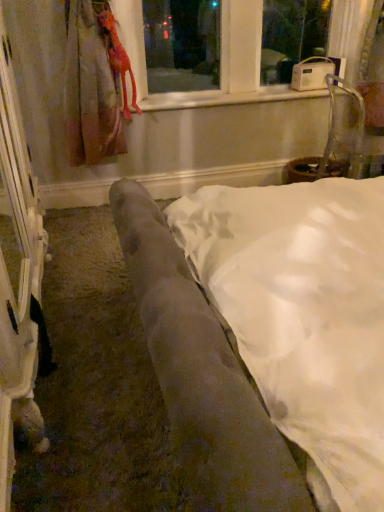
Question: Is white plastic radio at upper center smaller than velvet gray couch at center?

Choices:
 (A) no
 (B) yes

Answer: (B)

Question: From a real-world perspective, does white plastic radio at upper center stand above velvet gray couch at center?

Choices:
 (A) no
 (B) yes

Answer: (B)

Question: Is white plastic radio at upper center completely or partially outside of velvet gray couch at center?

Choices:
 (A) yes
 (B) no

Answer: (A)

Question: Are white plastic radio at upper center and velvet gray couch at center located far from each other?

Choices:
 (A) no
 (B) yes

Answer: (B)

Question: Considering the relative sizes of white plastic radio at upper center and velvet gray couch at center in the image provided, is white plastic radio at upper center wider than velvet gray couch at center?

Choices:
 (A) yes
 (B) no

Answer: (B)

Question: From a real-world perspective, is white plastic radio at upper center beneath velvet gray couch at center?

Choices:
 (A) no
 (B) yes

Answer: (A)

Question: Does white plastic radio at upper center have a lesser height compared to rubber duck at upper left?

Choices:
 (A) yes
 (B) no

Answer: (A)

Question: Is white plastic radio at upper center behind rubber duck at upper left?

Choices:
 (A) no
 (B) yes

Answer: (B)

Question: Would you consider white plastic radio at upper center to be distant from rubber duck at upper left?

Choices:
 (A) no
 (B) yes

Answer: (A)

Question: Does white plastic radio at upper center have a smaller size compared to rubber duck at upper left?

Choices:
 (A) yes
 (B) no

Answer: (B)

Question: Can you confirm if white plastic radio at upper center is wider than rubber duck at upper left?

Choices:
 (A) no
 (B) yes

Answer: (B)

Question: Is white plastic radio at upper center located outside rubber duck at upper left?

Choices:
 (A) yes
 (B) no

Answer: (A)

Question: Is rubber duck at upper left turned away from white plastic radio at upper center?

Choices:
 (A) yes
 (B) no

Answer: (A)